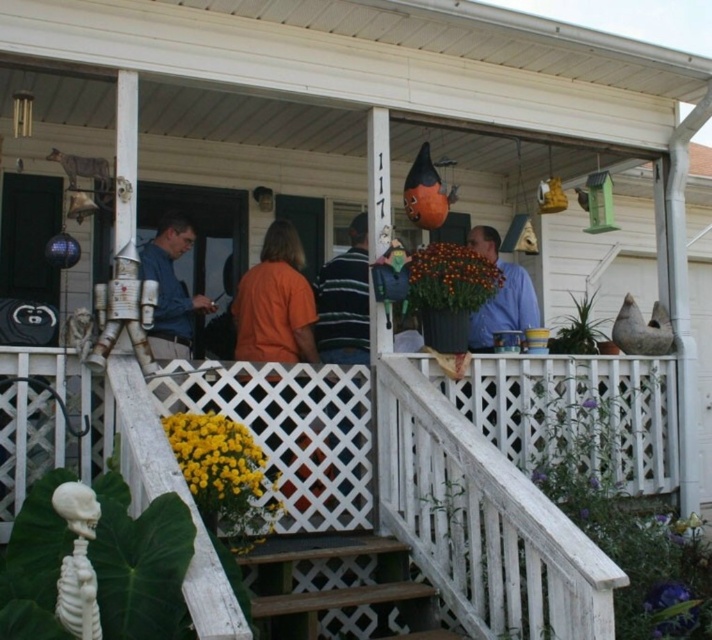
Is orange t-shirt at center smaller than blue fabric shirt at center?

Incorrect, orange t-shirt at center is not smaller in size than blue fabric shirt at center.

Where is `orange t-shirt at center`? Image resolution: width=712 pixels, height=640 pixels. orange t-shirt at center is located at coordinates (276, 301).

What do you see at coordinates (337, 586) in the screenshot? I see `wooden stairs at lower center` at bounding box center [337, 586].

How distant is wooden stairs at lower center from blue matte shirt at center?

They are 2.08 meters apart.

Find the location of a particular element. The height and width of the screenshot is (640, 712). wooden stairs at lower center is located at coordinates (337, 586).

Does point (308, 321) lie behind point (476, 324)?

No, it is not.

Does orange t-shirt at center come behind blue matte shirt at center?

That is False.

This screenshot has height=640, width=712. Describe the element at coordinates (276, 301) in the screenshot. I see `orange t-shirt at center` at that location.

The image size is (712, 640). Find the location of `orange t-shirt at center`. orange t-shirt at center is located at coordinates (276, 301).